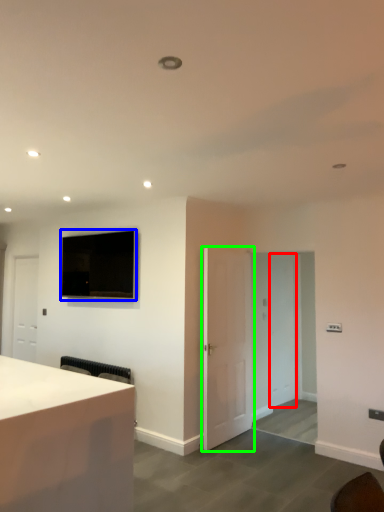
Question: Which object is the closest to the glass door (highlighted by a red box)? Choose among these: television (highlighted by a blue box) or door (highlighted by a green box).

Choices:
 (A) television
 (B) door

Answer: (B)